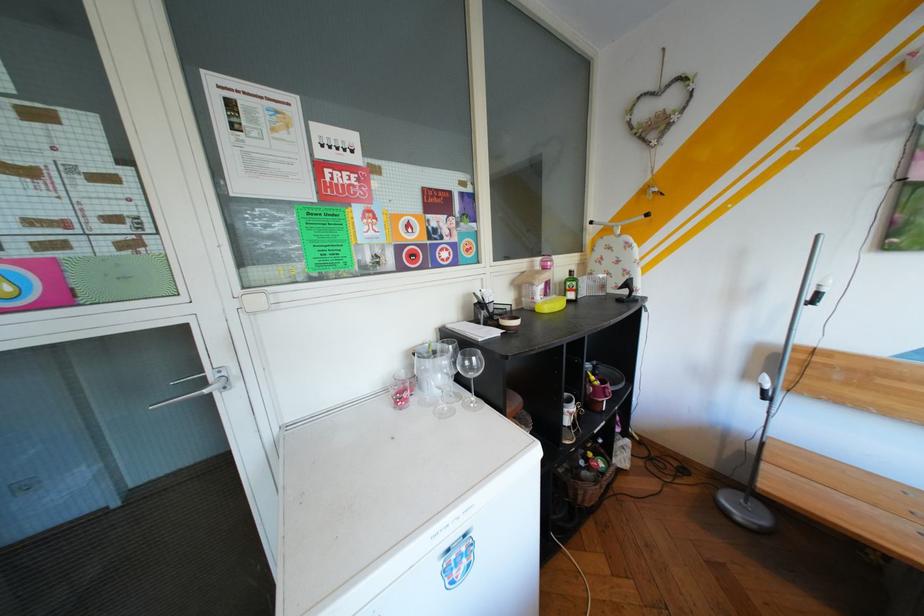
Describe the element at coordinates (200, 387) in the screenshot. I see `the silver door handle` at that location.